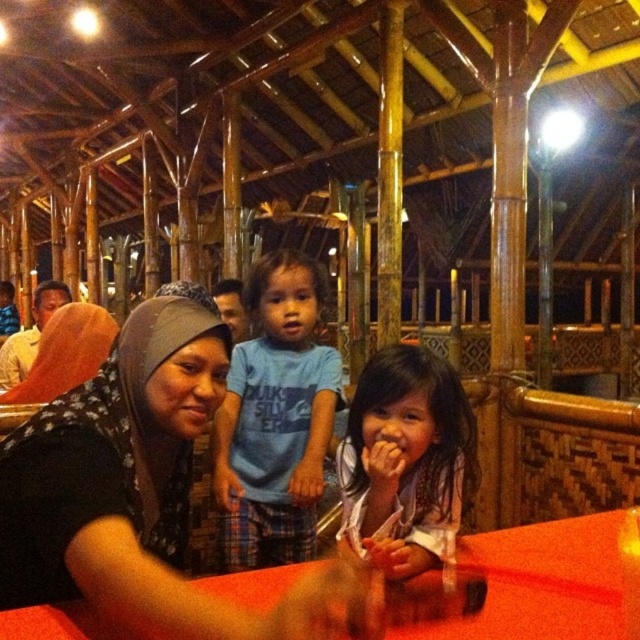
Is point (97, 451) positioned before point (262, 264)?

Yes.

Where is `matte black hijab at center`? matte black hijab at center is located at coordinates pos(140,492).

Does blue cotton shirt at center come in front of smooth red table at center?

No, blue cotton shirt at center is behind smooth red table at center.

Which is above, blue cotton shirt at center or smooth red table at center?

blue cotton shirt at center

Where is `blue cotton shirt at center`? blue cotton shirt at center is located at coordinates (275, 419).

Who is shorter, smooth brown hair at center or smooth red table at center?

Standing shorter between the two is smooth red table at center.

Is smooth brown hair at center in front of smooth red table at center?

That is False.

Find the location of a particular element. The width and height of the screenshot is (640, 640). smooth brown hair at center is located at coordinates (406, 458).